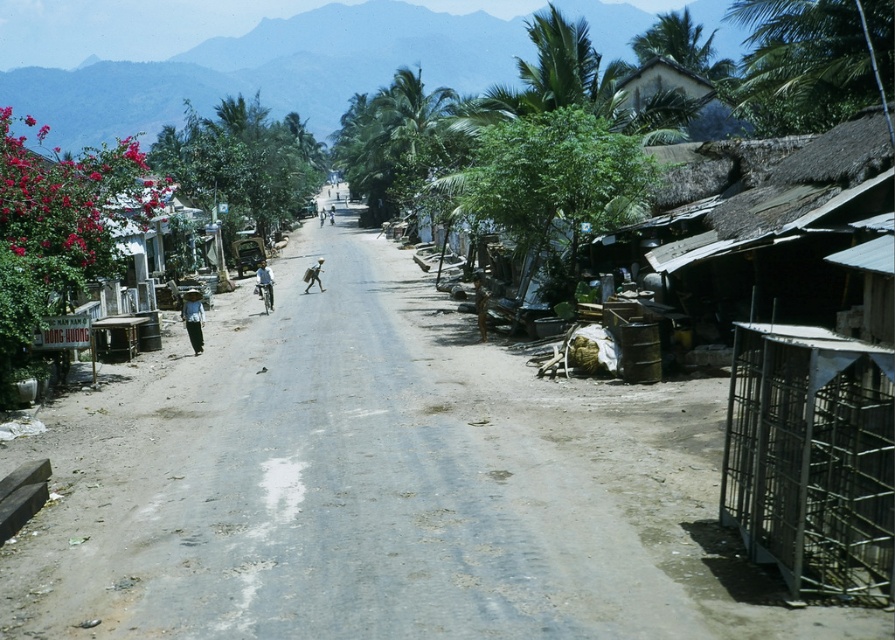
Question: Which point is farther to the camera?

Choices:
 (A) (188, 314)
 (B) (263, 298)
 (C) (308, 273)
 (D) (54, 580)

Answer: (C)

Question: Can you confirm if blue fabric shirt at center is thinner than light brown fabric bag at center?

Choices:
 (A) yes
 (B) no

Answer: (B)

Question: Can you confirm if dark blue fabric hat at center is positioned to the right of blue fabric shirt at center?

Choices:
 (A) yes
 (B) no

Answer: (A)

Question: Which point is farther from the camera taking this photo?

Choices:
 (A) (188, 307)
 (B) (206, 595)
 (C) (263, 294)
 (D) (318, 278)

Answer: (D)

Question: Is brown dirt track at left closer to camera compared to light brown fabric bag at center?

Choices:
 (A) no
 (B) yes

Answer: (B)

Question: Which is farther from the brown dirt track at left?

Choices:
 (A) light brown fabric bag at center
 (B) dark blue fabric hat at center
 (C) blue fabric shirt at center

Answer: (A)